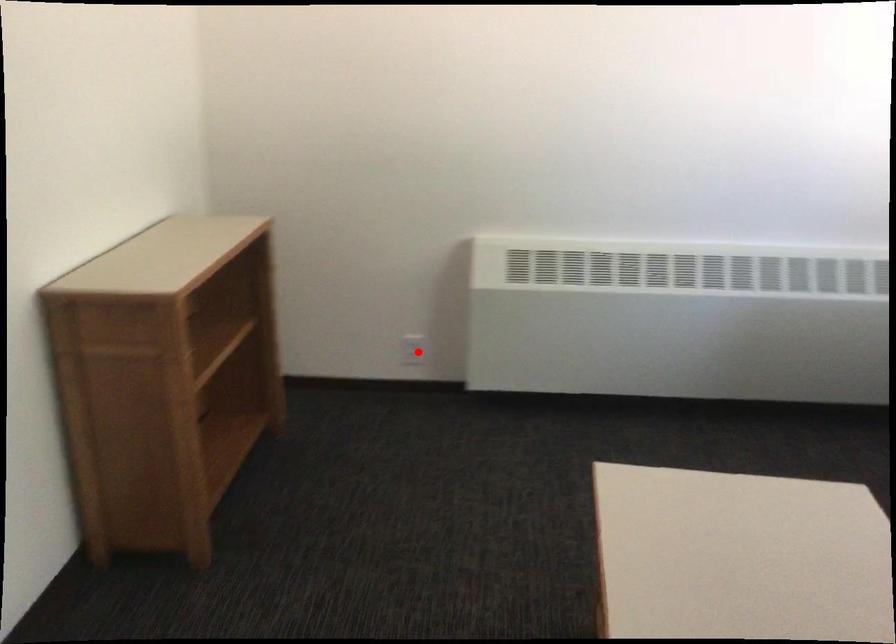
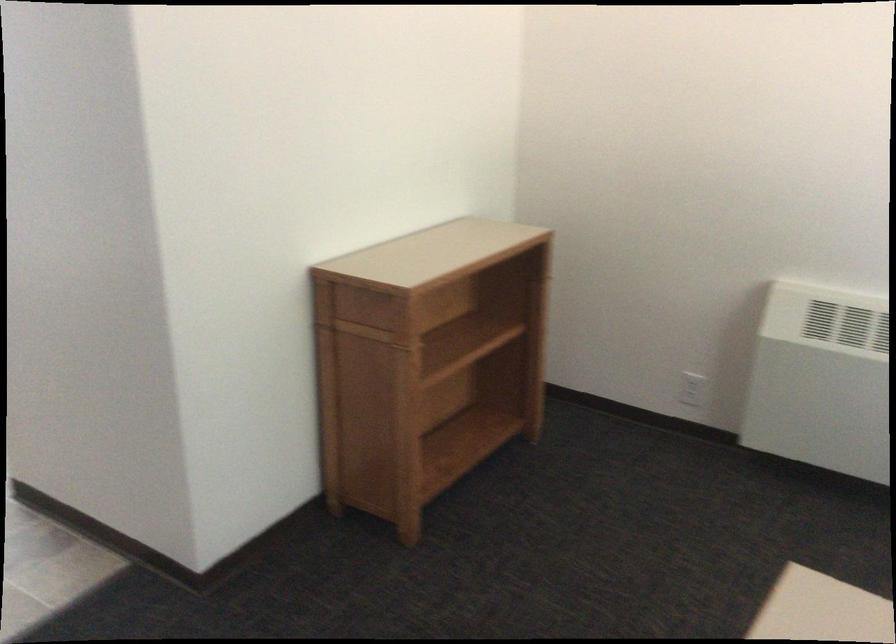
The point at the highlighted location is marked in the first image. Where is the corresponding point in the second image?

(692, 389)